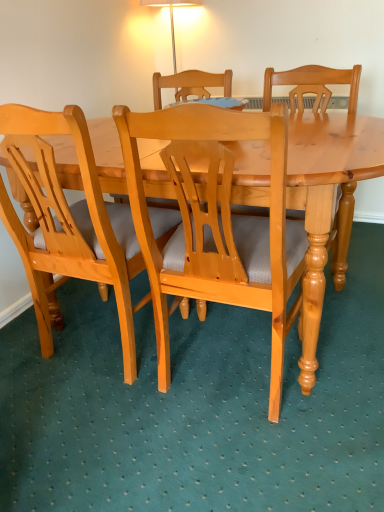
Find the location of a particular element. light brown wood chair at center, positioned as the first chair in right-to-left order is located at coordinates (216, 223).

Image resolution: width=384 pixels, height=512 pixels. Describe the element at coordinates (216, 223) in the screenshot. I see `light brown wood chair at center, placed as the second chair when sorted from left to right` at that location.

What is the approximate width of light brown wood chair at center, placed as the second chair when sorted from left to right?

light brown wood chair at center, placed as the second chair when sorted from left to right, is 55.08 centimeters wide.

Describe the element at coordinates (68, 223) in the screenshot. I see `matte wood chair at center, the 2th chair in the right-to-left sequence` at that location.

Locate an element on the screen. The height and width of the screenshot is (512, 384). matte wood chair at center, which is the 1th chair from left to right is located at coordinates (68, 223).

The width and height of the screenshot is (384, 512). Identify the location of light brown wood chair at center, placed as the second chair when sorted from left to right. (216, 223).

Is matte wood chair at center, the 2th chair in the right-to-left sequence, at the right side of light brown wood chair at center, positioned as the first chair in right-to-left order?

Incorrect, matte wood chair at center, the 2th chair in the right-to-left sequence, is not on the right side of light brown wood chair at center, positioned as the first chair in right-to-left order.

Between matte wood chair at center, which is the 1th chair from left to right, and light brown wood chair at center, placed as the second chair when sorted from left to right, which one is positioned in front?

light brown wood chair at center, placed as the second chair when sorted from left to right, is in front.

Is point (42, 151) closer to camera compared to point (188, 268)?

That is True.

From the image's perspective, would you say matte wood chair at center, which is the 1th chair from left to right, is positioned over light brown wood chair at center, placed as the second chair when sorted from left to right?

Correct, matte wood chair at center, which is the 1th chair from left to right, appears higher than light brown wood chair at center, placed as the second chair when sorted from left to right, in the image.

From a real-world perspective, between matte wood chair at center, the 2th chair in the right-to-left sequence, and light brown wood chair at center, placed as the second chair when sorted from left to right, who is vertically higher?

matte wood chair at center, the 2th chair in the right-to-left sequence.

In terms of width, does matte wood chair at center, the 2th chair in the right-to-left sequence, look wider or thinner when compared to light brown wood chair at center, positioned as the first chair in right-to-left order?

matte wood chair at center, the 2th chair in the right-to-left sequence, is thinner than light brown wood chair at center, positioned as the first chair in right-to-left order.

Who is taller, matte wood chair at center, the 2th chair in the right-to-left sequence, or light brown wood chair at center, positioned as the first chair in right-to-left order?

light brown wood chair at center, positioned as the first chair in right-to-left order.

Who is bigger, matte wood chair at center, the 2th chair in the right-to-left sequence, or light brown wood chair at center, positioned as the first chair in right-to-left order?

light brown wood chair at center, positioned as the first chair in right-to-left order, is bigger.

Is matte wood chair at center, which is the 1th chair from left to right, inside or outside of light brown wood chair at center, placed as the second chair when sorted from left to right?

matte wood chair at center, which is the 1th chair from left to right, exists outside the volume of light brown wood chair at center, placed as the second chair when sorted from left to right.

Are matte wood chair at center, the 2th chair in the right-to-left sequence, and light brown wood chair at center, placed as the second chair when sorted from left to right, beside each other?

matte wood chair at center, the 2th chair in the right-to-left sequence, is not next to light brown wood chair at center, placed as the second chair when sorted from left to right, and they're not touching.

Could you tell me if matte wood chair at center, which is the 1th chair from left to right, is turned towards light brown wood chair at center, placed as the second chair when sorted from left to right?

No, matte wood chair at center, which is the 1th chair from left to right, is not oriented towards light brown wood chair at center, placed as the second chair when sorted from left to right.

Can you tell me how much matte wood chair at center, the 2th chair in the right-to-left sequence, and light brown wood chair at center, placed as the second chair when sorted from left to right, differ in facing direction?

They differ by 1.61 degrees in their facing directions.

Locate an element on the screen. This screenshot has width=384, height=512. chair on the left of light brown wood chair at center, placed as the second chair when sorted from left to right is located at coordinates (68, 223).

Is light brown wood chair at center, positioned as the first chair in right-to-left order, to the right of matte wood chair at center, which is the 1th chair from left to right, from the viewer's perspective?

Indeed, light brown wood chair at center, positioned as the first chair in right-to-left order, is positioned on the right side of matte wood chair at center, which is the 1th chair from left to right.

Considering the positions of objects light brown wood chair at center, placed as the second chair when sorted from left to right, and matte wood chair at center, the 2th chair in the right-to-left sequence, in the image provided, who is behind, light brown wood chair at center, placed as the second chair when sorted from left to right, or matte wood chair at center, the 2th chair in the right-to-left sequence,?

matte wood chair at center, the 2th chair in the right-to-left sequence, is behind.

Which is behind, point (165, 289) or point (123, 241)?

Point (123, 241)

From the image's perspective, is light brown wood chair at center, placed as the second chair when sorted from left to right, located above or below matte wood chair at center, the 2th chair in the right-to-left sequence?

light brown wood chair at center, placed as the second chair when sorted from left to right, is below matte wood chair at center, the 2th chair in the right-to-left sequence.

Based on the photo, from a real-world perspective, which is physically below, light brown wood chair at center, placed as the second chair when sorted from left to right, or matte wood chair at center, which is the 1th chair from left to right?

light brown wood chair at center, placed as the second chair when sorted from left to right.

Considering the sizes of light brown wood chair at center, positioned as the first chair in right-to-left order, and matte wood chair at center, the 2th chair in the right-to-left sequence, in the image, is light brown wood chair at center, positioned as the first chair in right-to-left order, wider or thinner than matte wood chair at center, the 2th chair in the right-to-left sequence,?

light brown wood chair at center, positioned as the first chair in right-to-left order, is wider than matte wood chair at center, the 2th chair in the right-to-left sequence.

Considering the relative sizes of light brown wood chair at center, placed as the second chair when sorted from left to right, and matte wood chair at center, which is the 1th chair from left to right, in the image provided, is light brown wood chair at center, placed as the second chair when sorted from left to right, taller than matte wood chair at center, which is the 1th chair from left to right,?

Correct, light brown wood chair at center, placed as the second chair when sorted from left to right, is much taller as matte wood chair at center, which is the 1th chair from left to right.

Who is bigger, light brown wood chair at center, positioned as the first chair in right-to-left order, or matte wood chair at center, the 2th chair in the right-to-left sequence?

light brown wood chair at center, positioned as the first chair in right-to-left order.

Looking at this image, is light brown wood chair at center, positioned as the first chair in right-to-left order, not within matte wood chair at center, the 2th chair in the right-to-left sequence?

Result: Yes.

Is the surface of light brown wood chair at center, placed as the second chair when sorted from left to right, in direct contact with matte wood chair at center, the 2th chair in the right-to-left sequence?

No.

Is light brown wood chair at center, positioned as the first chair in right-to-left order, aimed at matte wood chair at center, the 2th chair in the right-to-left sequence?

No.

Based on the photo, how many degrees apart are the facing directions of light brown wood chair at center, positioned as the first chair in right-to-left order, and matte wood chair at center, the 2th chair in the right-to-left sequence?

1.61 degrees.

What are the coordinates of `chair that appears above the light brown wood chair at center, placed as the second chair when sorted from left to right (from a real-world perspective)` in the screenshot? It's located at (68, 223).

Where is `chair above the light brown wood chair at center, positioned as the first chair in right-to-left order (from a real-world perspective)`? The width and height of the screenshot is (384, 512). chair above the light brown wood chair at center, positioned as the first chair in right-to-left order (from a real-world perspective) is located at coordinates (68, 223).

Image resolution: width=384 pixels, height=512 pixels. I want to click on chair below the matte wood chair at center, the 2th chair in the right-to-left sequence (from a real-world perspective), so click(x=216, y=223).